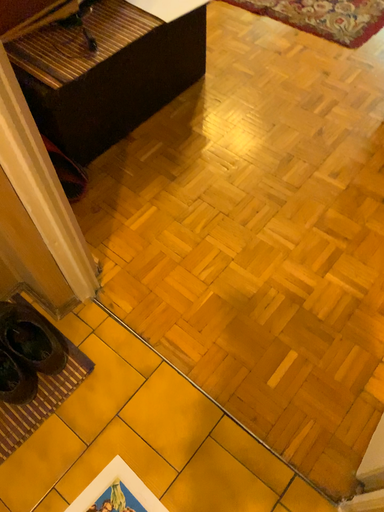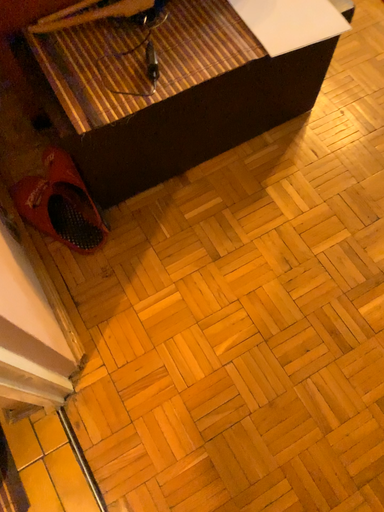
Question: Which way did the camera rotate in the video?

Choices:
 (A) rotated upward
 (B) rotated downward

Answer: (B)